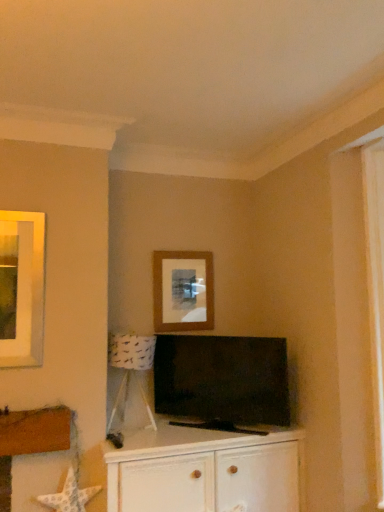
Question: Considering the relative sizes of matte brown picture frame at center and white paper lampshade at lower left in the image provided, is matte brown picture frame at center thinner than white paper lampshade at lower left?

Choices:
 (A) yes
 (B) no

Answer: (A)

Question: Is matte brown picture frame at center not near white paper lampshade at lower left?

Choices:
 (A) yes
 (B) no

Answer: (B)

Question: Is matte brown picture frame at center with white paper lampshade at lower left?

Choices:
 (A) no
 (B) yes

Answer: (A)

Question: From the image's perspective, is matte brown picture frame at center located above white paper lampshade at lower left?

Choices:
 (A) no
 (B) yes

Answer: (B)

Question: From a real-world perspective, is matte brown picture frame at center under white paper lampshade at lower left?

Choices:
 (A) no
 (B) yes

Answer: (A)

Question: From the image's perspective, relative to white paper lampshade at lower left, is white wood cabinet at center above or below?

Choices:
 (A) below
 (B) above

Answer: (A)

Question: Relative to white paper lampshade at lower left, is white wood cabinet at center in front or behind?

Choices:
 (A) front
 (B) behind

Answer: (A)

Question: In terms of height, does white wood cabinet at center look taller or shorter compared to white paper lampshade at lower left?

Choices:
 (A) short
 (B) tall

Answer: (B)

Question: Is white wood cabinet at center wider or thinner than white paper lampshade at lower left?

Choices:
 (A) wide
 (B) thin

Answer: (A)

Question: Considering their positions, is white paper lampshade at lower left located in front of or behind matte black tv at center?

Choices:
 (A) front
 (B) behind

Answer: (B)

Question: Is point (119, 333) positioned closer to the camera than point (256, 382)?

Choices:
 (A) closer
 (B) farther

Answer: (B)

Question: Looking at their shapes, would you say white paper lampshade at lower left is wider or thinner than matte black tv at center?

Choices:
 (A) wide
 (B) thin

Answer: (A)

Question: Considering the positions of white paper lampshade at lower left and matte black tv at center in the image, is white paper lampshade at lower left bigger or smaller than matte black tv at center?

Choices:
 (A) big
 (B) small

Answer: (B)

Question: From their relative heights in the image, would you say matte brown picture frame at center is taller or shorter than white wood cabinet at center?

Choices:
 (A) tall
 (B) short

Answer: (B)

Question: Is matte brown picture frame at center in front of or behind white wood cabinet at center in the image?

Choices:
 (A) front
 (B) behind

Answer: (B)